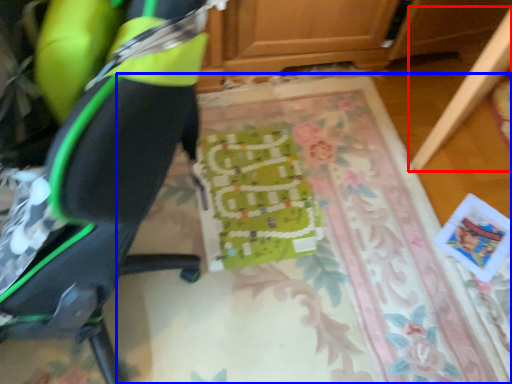
Question: Which point is closer to the camera, furniture (highlighted by a red box) or mat (highlighted by a blue box)?

Choices:
 (A) furniture
 (B) mat

Answer: (A)